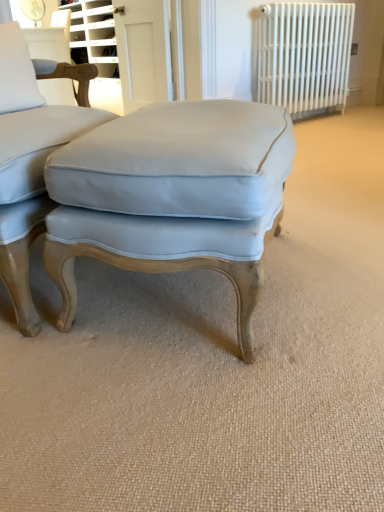
Question: Considering the relative sizes of white glossy door at upper center and white metal radiator at upper right in the image provided, is white glossy door at upper center smaller than white metal radiator at upper right?

Choices:
 (A) no
 (B) yes

Answer: (B)

Question: Is white glossy door at upper center with white metal radiator at upper right?

Choices:
 (A) yes
 (B) no

Answer: (B)

Question: Is white glossy door at upper center positioned behind white metal radiator at upper right?

Choices:
 (A) no
 (B) yes

Answer: (B)

Question: From a real-world perspective, is white glossy door at upper center located higher than white metal radiator at upper right?

Choices:
 (A) no
 (B) yes

Answer: (B)

Question: From a real-world perspective, is white glossy door at upper center physically below white metal radiator at upper right?

Choices:
 (A) yes
 (B) no

Answer: (B)

Question: Does white glossy door at upper center have a greater height compared to white metal radiator at upper right?

Choices:
 (A) no
 (B) yes

Answer: (A)

Question: Can you confirm if white metal radiator at upper right is positioned to the right of white glossy door at upper center?

Choices:
 (A) no
 (B) yes

Answer: (B)

Question: From the image's perspective, is white metal radiator at upper right on white glossy door at upper center?

Choices:
 (A) no
 (B) yes

Answer: (B)

Question: From a real-world perspective, is white metal radiator at upper right beneath white glossy door at upper center?

Choices:
 (A) yes
 (B) no

Answer: (A)

Question: From a real-world perspective, is white metal radiator at upper right positioned over white glossy door at upper center based on gravity?

Choices:
 (A) yes
 (B) no

Answer: (B)

Question: Is white metal radiator at upper right taller than white glossy door at upper center?

Choices:
 (A) yes
 (B) no

Answer: (A)

Question: Is white metal radiator at upper right facing away from white glossy door at upper center?

Choices:
 (A) yes
 (B) no

Answer: (B)

Question: Would you consider white glossy door at upper center to be distant from light blue fabric ottoman at center?

Choices:
 (A) no
 (B) yes

Answer: (B)